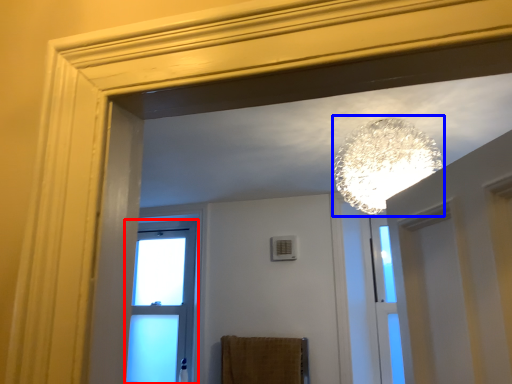
Question: Which of the following is the closest to the observer, window (highlighted by a red box) or lamp (highlighted by a blue box)?

Choices:
 (A) window
 (B) lamp

Answer: (B)